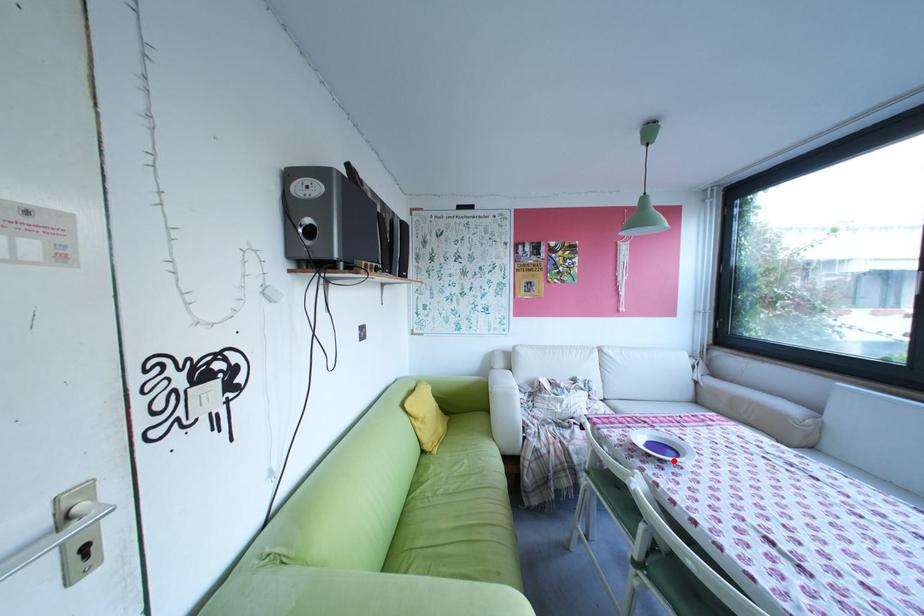
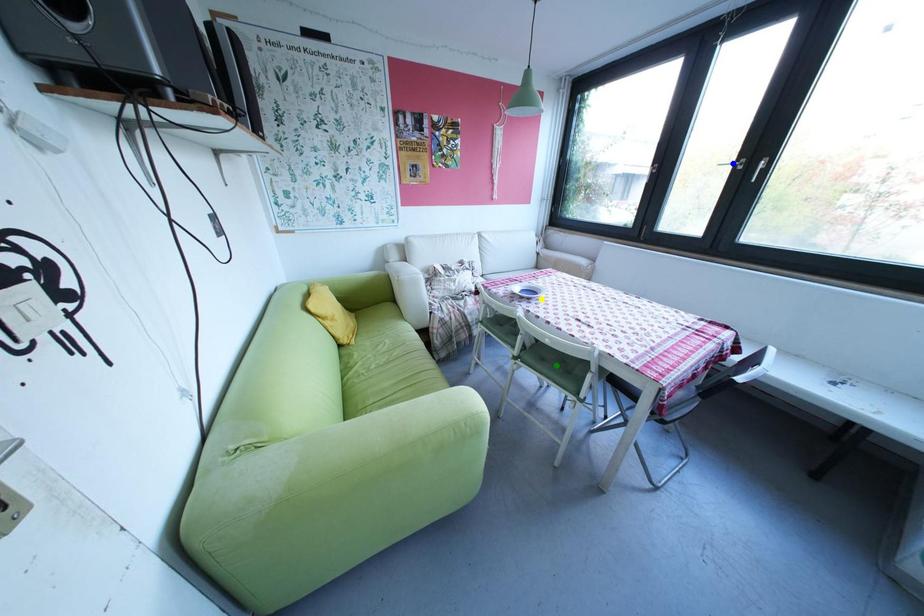
Question: I am providing you with two images of the same scene from different viewpoints. A red point is marked on the first image. You are given multiple points on the second image. Which point in image 2 represents the same 3d spot as the red point in image 1?

Choices:
 (A) green point
 (B) yellow point
 (C) blue point

Answer: (B)